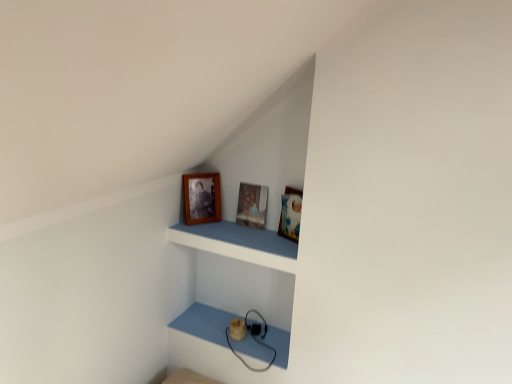
Question: Is wooden picture frame at center, which is the first picture frame in right-to-left order, shorter than wooden photo frame at upper center, which is counted as the second picture frame, starting from the right?

Choices:
 (A) no
 (B) yes

Answer: (B)

Question: Is wooden picture frame at center, which is the first picture frame in right-to-left order, bigger than wooden photo frame at upper center, placed as the 1th picture frame when sorted from left to right?

Choices:
 (A) no
 (B) yes

Answer: (A)

Question: Is wooden picture frame at center, which is the first picture frame in right-to-left order, thinner than wooden photo frame at upper center, placed as the 1th picture frame when sorted from left to right?

Choices:
 (A) no
 (B) yes

Answer: (A)

Question: Is wooden picture frame at center, positioned as the 2th picture frame in left-to-right order, oriented away from wooden photo frame at upper center, which is counted as the second picture frame, starting from the right?

Choices:
 (A) yes
 (B) no

Answer: (B)

Question: Is wooden photo frame at upper center, which is counted as the second picture frame, starting from the right, surrounded by wooden picture frame at center, which is the first picture frame in right-to-left order?

Choices:
 (A) yes
 (B) no

Answer: (B)

Question: Does point (239, 198) appear closer or farther from the camera than point (266, 243)?

Choices:
 (A) closer
 (B) farther

Answer: (B)

Question: Would you say wooden picture frame at center, which is the first picture frame in right-to-left order, is inside or outside wooden frame at upper center?

Choices:
 (A) outside
 (B) inside

Answer: (A)

Question: From a real-world perspective, is wooden picture frame at center, positioned as the 2th picture frame in left-to-right order, physically located above or below wooden frame at upper center?

Choices:
 (A) below
 (B) above

Answer: (B)

Question: From their relative heights in the image, would you say wooden picture frame at center, which is the first picture frame in right-to-left order, is taller or shorter than wooden frame at upper center?

Choices:
 (A) short
 (B) tall

Answer: (B)

Question: In terms of height, does wooden photo frame at upper center, which is counted as the second picture frame, starting from the right, look taller or shorter compared to wooden frame at upper center?

Choices:
 (A) short
 (B) tall

Answer: (B)

Question: From the image's perspective, is wooden photo frame at upper center, which is counted as the second picture frame, starting from the right, above or below wooden frame at upper center?

Choices:
 (A) below
 (B) above

Answer: (B)

Question: From a real-world perspective, relative to wooden frame at upper center, is wooden photo frame at upper center, placed as the 1th picture frame when sorted from left to right, vertically above or below?

Choices:
 (A) above
 (B) below

Answer: (A)

Question: In the image, is wooden photo frame at upper center, which is counted as the second picture frame, starting from the right, positioned in front of or behind wooden frame at upper center?

Choices:
 (A) behind
 (B) front

Answer: (A)

Question: From the image's perspective, relative to wooden picture frame at center, positioned as the 2th picture frame in left-to-right order, is wooden photo frame at upper center, placed as the 1th picture frame when sorted from left to right, above or below?

Choices:
 (A) above
 (B) below

Answer: (A)

Question: Is wooden photo frame at upper center, placed as the 1th picture frame when sorted from left to right, in front of or behind wooden picture frame at center, positioned as the 2th picture frame in left-to-right order, in the image?

Choices:
 (A) front
 (B) behind

Answer: (A)